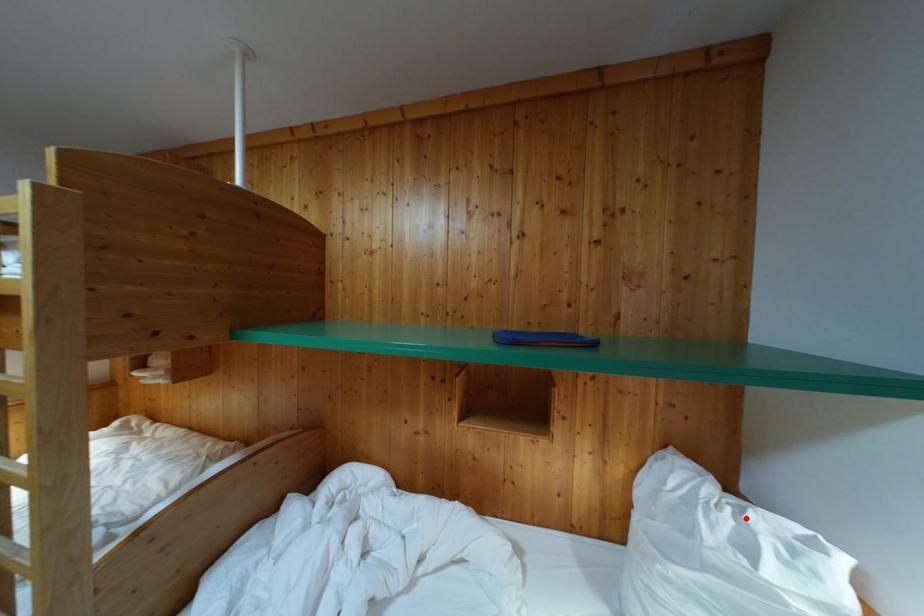
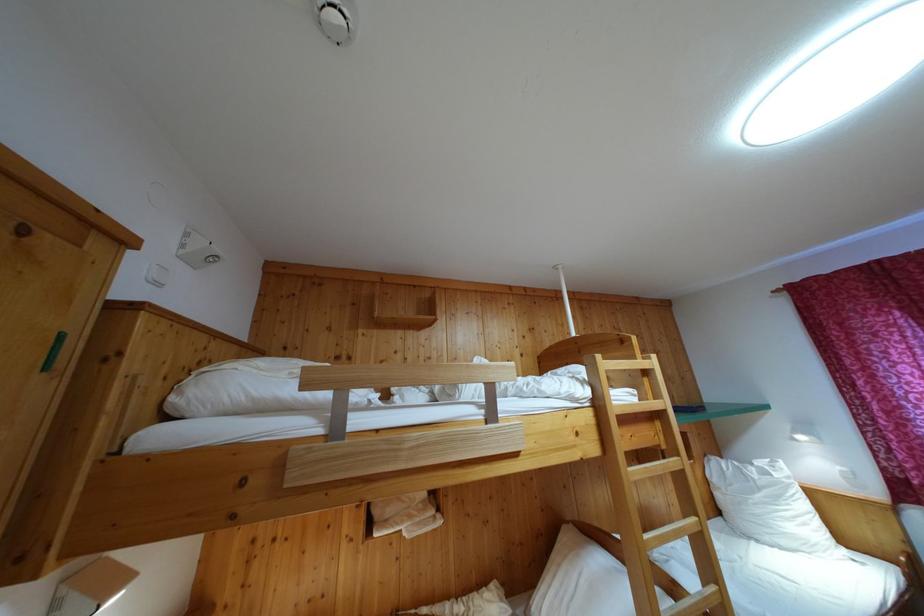
Find the pixel in the second image that matches the highlighted location in the first image.

(755, 471)